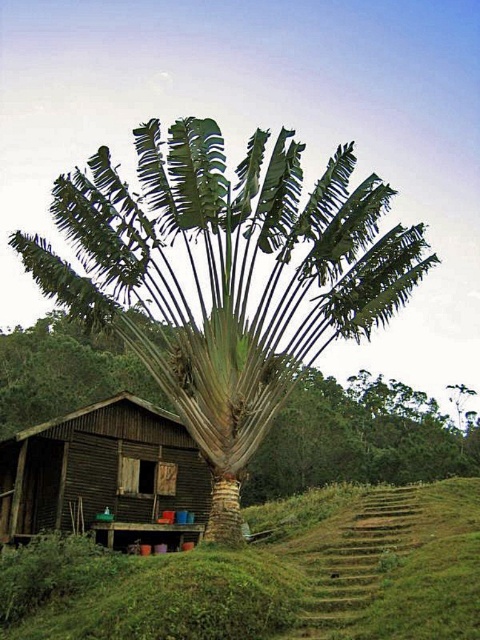
Question: Can you confirm if green leafy palm at center is thinner than brown wooden hut at lower left?

Choices:
 (A) no
 (B) yes

Answer: (A)

Question: Which point appears farthest from the camera in this image?

Choices:
 (A) (144, 474)
 (B) (180, 348)

Answer: (A)

Question: Is green leafy palm at center wider than brown wooden hut at lower left?

Choices:
 (A) yes
 (B) no

Answer: (A)

Question: Is green leafy banana tree at center thinner than green leafy palm at center?

Choices:
 (A) no
 (B) yes

Answer: (B)

Question: Which point is closer to the camera?

Choices:
 (A) brown wooden hut at lower left
 (B) green leafy palm at center

Answer: (A)

Question: Among these points, which one is farthest from the camera?

Choices:
 (A) (97, 234)
 (B) (4, 500)

Answer: (B)